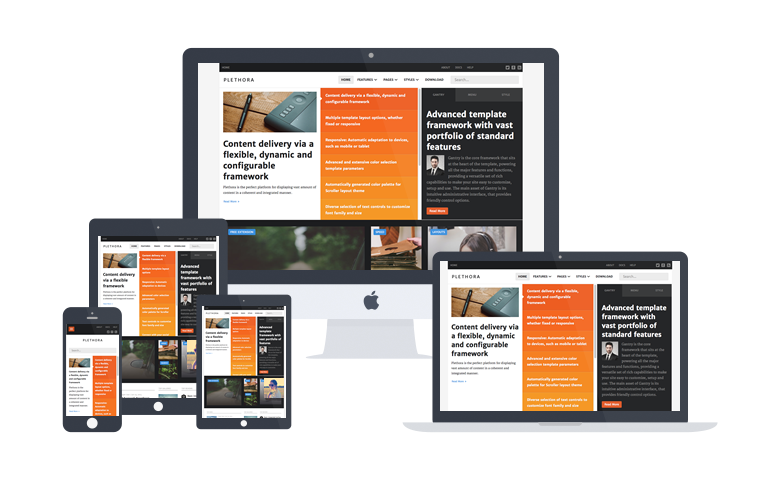
In order to click on phone in this screenshot , I will do `click(73, 313)`.